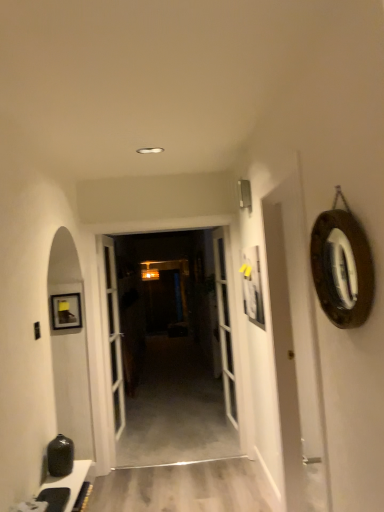
Question: From the image's perspective, is wooden at center positioned above or below matte black cabinet at lower left?

Choices:
 (A) above
 (B) below

Answer: (A)

Question: Relative to matte black cabinet at lower left, is wooden at center in front or behind?

Choices:
 (A) front
 (B) behind

Answer: (B)

Question: Which object is the farthest from the matte black cabinet at lower left?

Choices:
 (A) wooden-framed mirror at right
 (B) wooden at center
 (C) white glass door at center, acting as the second door starting from the left
 (D) white glossy door at center, arranged as the first door when viewed from the left

Answer: (B)

Question: Based on their relative distances, which object is nearer to the wooden-framed mirror at right?

Choices:
 (A) white glass door at center, the first door viewed from the right
 (B) matte black cabinet at lower left
 (C) white glossy door at center, arranged as the first door when viewed from the left
 (D) wooden at center

Answer: (B)